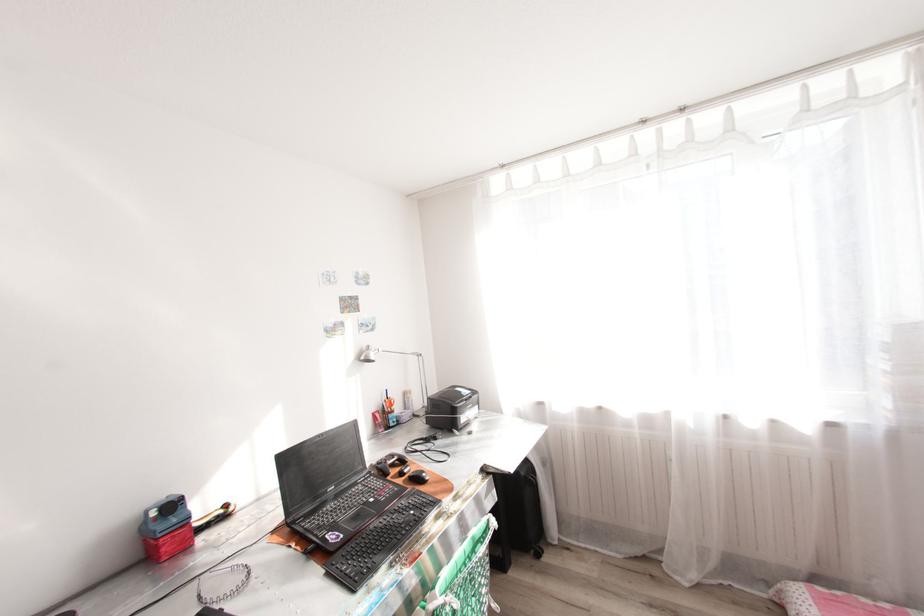
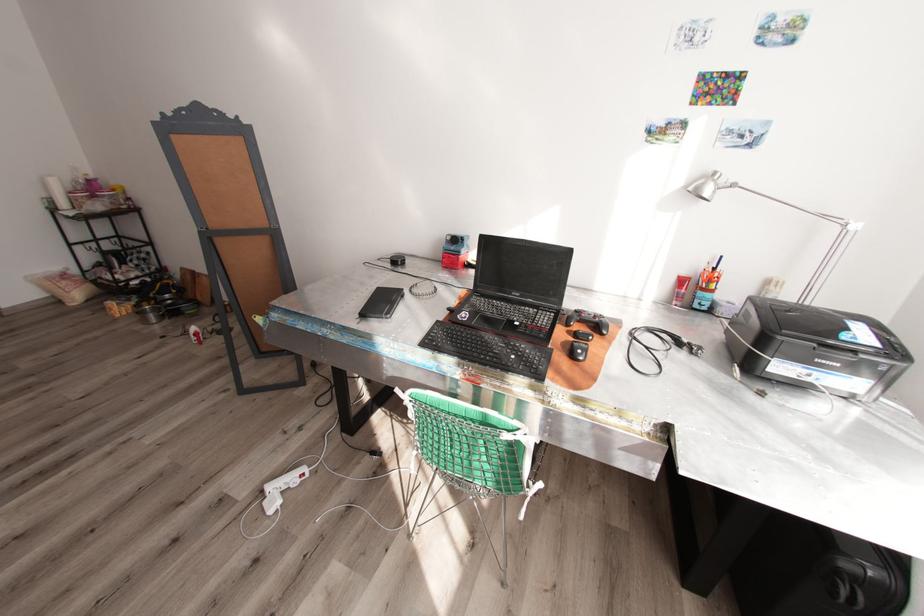
Locate, in the second image, the point that corresponds to pixel 337 487 in the first image.

(523, 294)